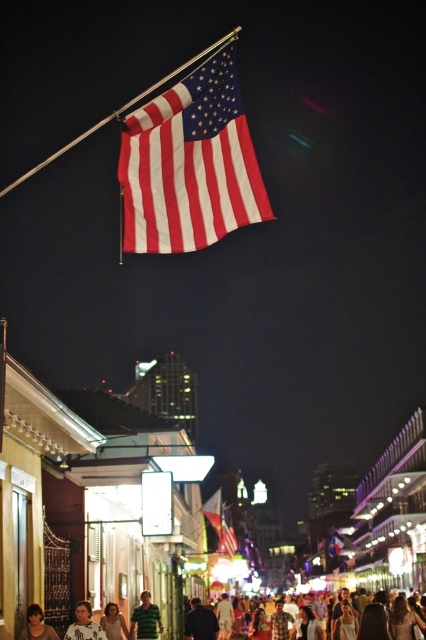
You are a photographer standing on the street and want to capture both the smooth brown hair at lower left and the matte fabric flag at center in a single frame. Which object should you focus on first to ensure both are in the shot?

The smooth brown hair at lower left is shorter than the matte fabric flag at center, so you should focus on the matte fabric flag at center first to ensure both are in the shot.

You are a photographer standing in the middle of the street. You notice the matte fabric flag at upper center and the black matte jacket at center. Which object is positioned to the right from your viewpoint?

The matte fabric flag at upper center is to the right of the black matte jacket at center from the photographer viewpoint.

You are a photographer standing in the middle of the street, aiming to capture a photo of the white shirt at center and smooth brown hair at lower left. Which object should you adjust your camera angle upwards to include in the frame first?

You should adjust your camera angle upwards to include the smooth brown hair at lower left first because the white shirt at center is positioned under it, meaning the smooth brown hair at lower left is higher in the frame.